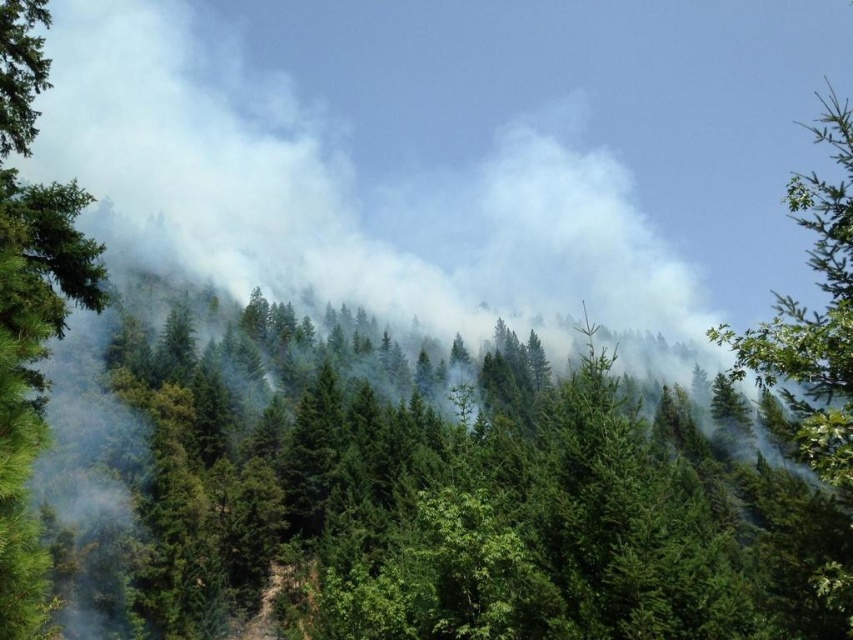
Between green matte tree at left and green leafy tree at upper right, which one is positioned lower?

Positioned lower is green leafy tree at upper right.

Describe the element at coordinates (30, 308) in the screenshot. The image size is (853, 640). I see `green matte tree at left` at that location.

The image size is (853, 640). What do you see at coordinates (30, 308) in the screenshot?
I see `green matte tree at left` at bounding box center [30, 308].

Locate an element on the screen. green matte tree at left is located at coordinates (30, 308).